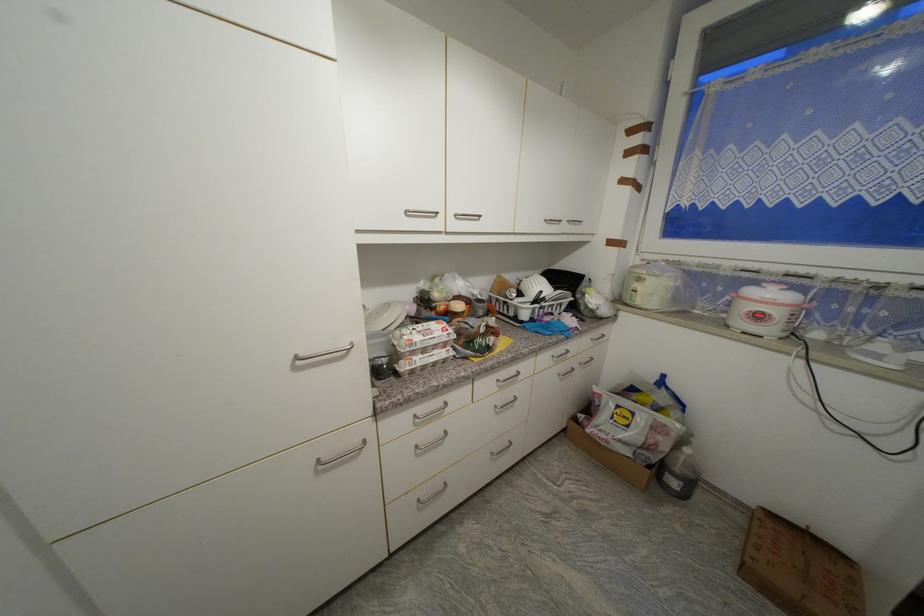
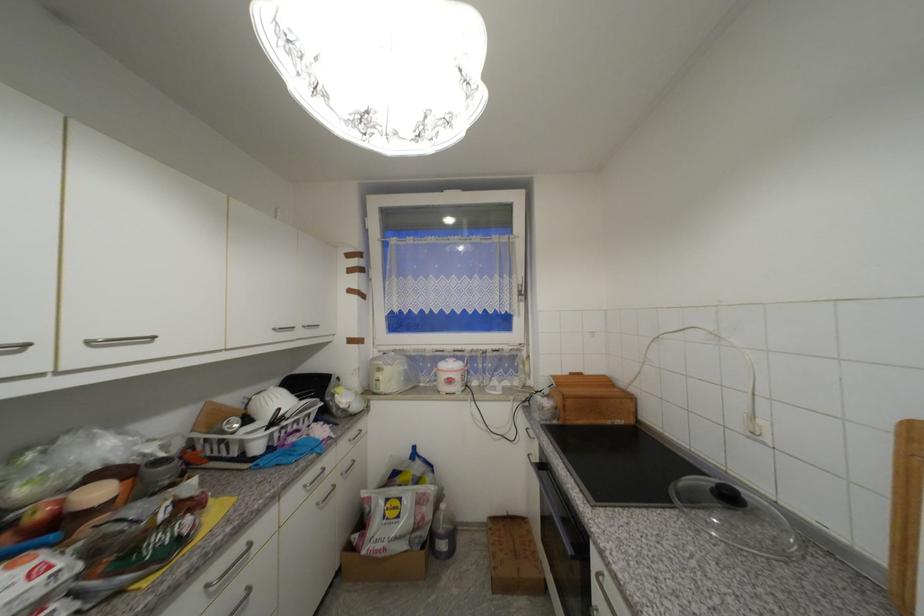
Find the pixel in the second image that matches the point at 504,382 in the first image.

(213, 588)